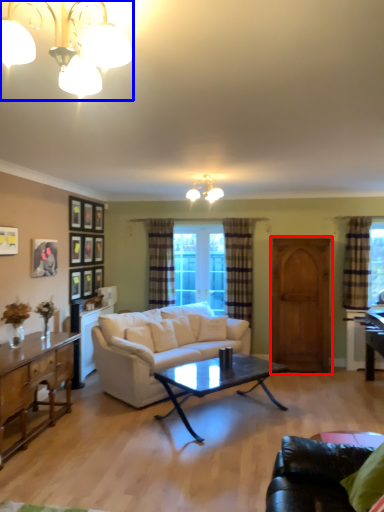
Question: Which object is further to the camera taking this photo, armoire (highlighted by a red box) or lamp (highlighted by a blue box)?

Choices:
 (A) armoire
 (B) lamp

Answer: (A)